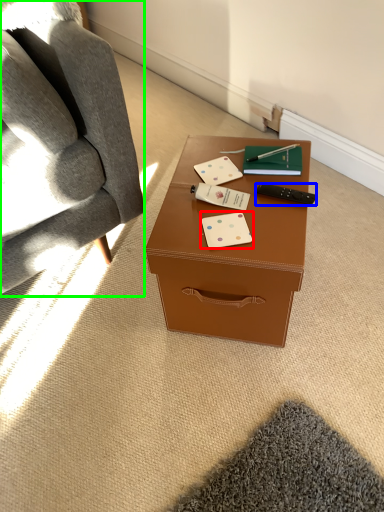
Question: Estimate the real-world distances between objects in this image. Which object is farther from business card (highlighted by a red box), remote control (highlighted by a blue box) or chair (highlighted by a green box)?

Choices:
 (A) remote control
 (B) chair

Answer: (B)